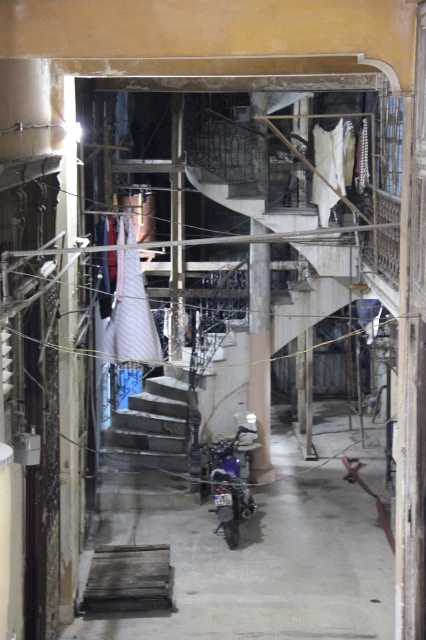
Question: Does concrete stairs at center have a smaller size compared to white fabric at center?

Choices:
 (A) no
 (B) yes

Answer: (A)

Question: Which point is farther to the camera?

Choices:
 (A) (253, 308)
 (B) (170, 419)
 (C) (236, 477)

Answer: (B)

Question: Estimate the real-world distances between objects in this image. Which object is farther from the smooth concrete pillar at center?

Choices:
 (A) shiny blue motorcycle at center
 (B) white fabric at center
 (C) concrete stairs at center

Answer: (A)

Question: Among these objects, which one is nearest to the camera?

Choices:
 (A) concrete stairs at center
 (B) shiny blue motorcycle at center
 (C) white fabric at center
 (D) smooth concrete pillar at center

Answer: (B)

Question: Is concrete stairs at center thinner than smooth concrete pillar at center?

Choices:
 (A) no
 (B) yes

Answer: (A)

Question: From the image, what is the correct spatial relationship of smooth concrete pillar at center in relation to shiny blue motorcycle at center?

Choices:
 (A) left
 (B) right

Answer: (B)